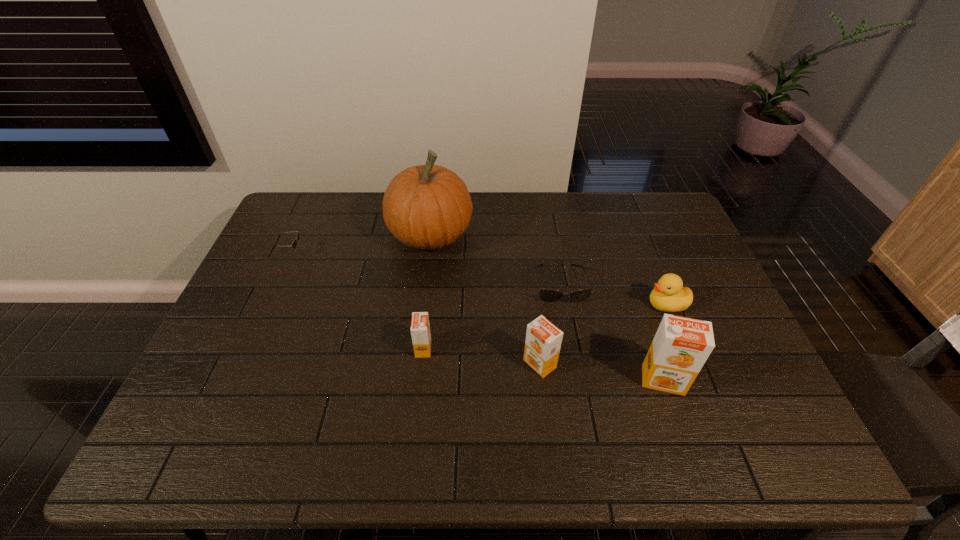
The image size is (960, 540). What are the coordinates of `object situated at the far edge` in the screenshot? It's located at [428, 206].

At what (x,y) coordinates should I click in order to perform the action: click on object located at the near edge. Please return your answer as a coordinate pair (x, y). Image resolution: width=960 pixels, height=540 pixels. Looking at the image, I should click on (681, 346).

What are the coordinates of `object present at the left edge` in the screenshot? It's located at (294, 244).

The width and height of the screenshot is (960, 540). I want to click on object present at the right edge, so click(669, 295).

The height and width of the screenshot is (540, 960). What are the coordinates of `vacant space at the far edge` in the screenshot? It's located at (573, 194).

Identify the location of vacant region at the near edge of the desktop. (638, 381).

This screenshot has width=960, height=540. Find the location of `vacant space at the right edge of the desktop`. vacant space at the right edge of the desktop is located at coordinates (719, 374).

In the image, there is a desktop. Where is `free space at the far left corner`? The width and height of the screenshot is (960, 540). free space at the far left corner is located at coordinates (289, 201).

At what (x,y) coordinates should I click in order to perform the action: click on vacant space at the far right corner of the desktop. Please return your answer as a coordinate pair (x, y). The image size is (960, 540). Looking at the image, I should click on (661, 193).

At what (x,y) coordinates should I click in order to perform the action: click on free space between the rightmost orange juice and the tallest object. Please return your answer as a coordinate pair (x, y). Image resolution: width=960 pixels, height=540 pixels. Looking at the image, I should click on (547, 308).